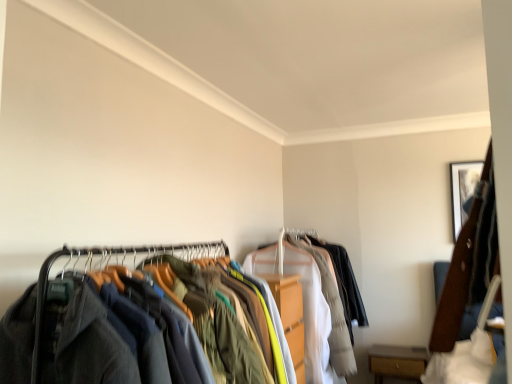
Question: Is wooden framed picture at upper right bigger than light gray cotton shirt at center?

Choices:
 (A) yes
 (B) no

Answer: (B)

Question: Considering the relative sizes of wooden framed picture at upper right and light gray cotton shirt at center in the image provided, is wooden framed picture at upper right wider than light gray cotton shirt at center?

Choices:
 (A) no
 (B) yes

Answer: (A)

Question: Is wooden framed picture at upper right positioned beyond the bounds of light gray cotton shirt at center?

Choices:
 (A) yes
 (B) no

Answer: (A)

Question: From a real-world perspective, is wooden framed picture at upper right physically above light gray cotton shirt at center?

Choices:
 (A) no
 (B) yes

Answer: (B)

Question: Considering the relative positions of wooden framed picture at upper right and light gray cotton shirt at center in the image provided, is wooden framed picture at upper right to the left of light gray cotton shirt at center from the viewer's perspective?

Choices:
 (A) yes
 (B) no

Answer: (B)

Question: Is wooden framed picture at upper right next to light gray cotton shirt at center and touching it?

Choices:
 (A) yes
 (B) no

Answer: (B)

Question: From a real-world perspective, is brown wood drawer at lower right physically above dark gray fabric clothes at left?

Choices:
 (A) no
 (B) yes

Answer: (A)

Question: Does brown wood drawer at lower right have a smaller size compared to dark gray fabric clothes at left?

Choices:
 (A) yes
 (B) no

Answer: (A)

Question: Considering the relative sizes of brown wood drawer at lower right and dark gray fabric clothes at left in the image provided, is brown wood drawer at lower right bigger than dark gray fabric clothes at left?

Choices:
 (A) yes
 (B) no

Answer: (B)

Question: From a real-world perspective, is brown wood drawer at lower right under dark gray fabric clothes at left?

Choices:
 (A) yes
 (B) no

Answer: (A)

Question: Is dark gray fabric clothes at left a part of brown wood drawer at lower right?

Choices:
 (A) yes
 (B) no

Answer: (B)

Question: From the image's perspective, is brown wood drawer at lower right under dark gray fabric clothes at left?

Choices:
 (A) yes
 (B) no

Answer: (A)

Question: Considering the relative sizes of light gray cotton shirt at center and brown wood drawer at lower right in the image provided, is light gray cotton shirt at center smaller than brown wood drawer at lower right?

Choices:
 (A) no
 (B) yes

Answer: (A)